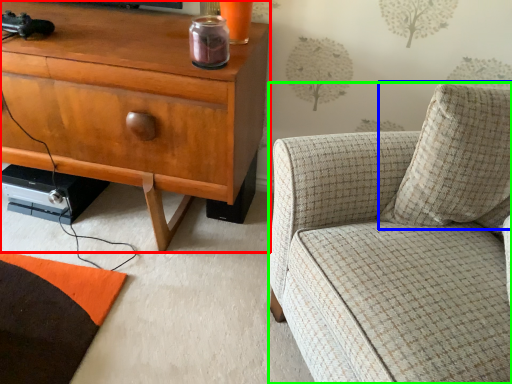
Question: Which is farther away from cabinetry (highlighted by a red box)? pillow (highlighted by a blue box) or chair (highlighted by a green box)?

Choices:
 (A) pillow
 (B) chair

Answer: (A)